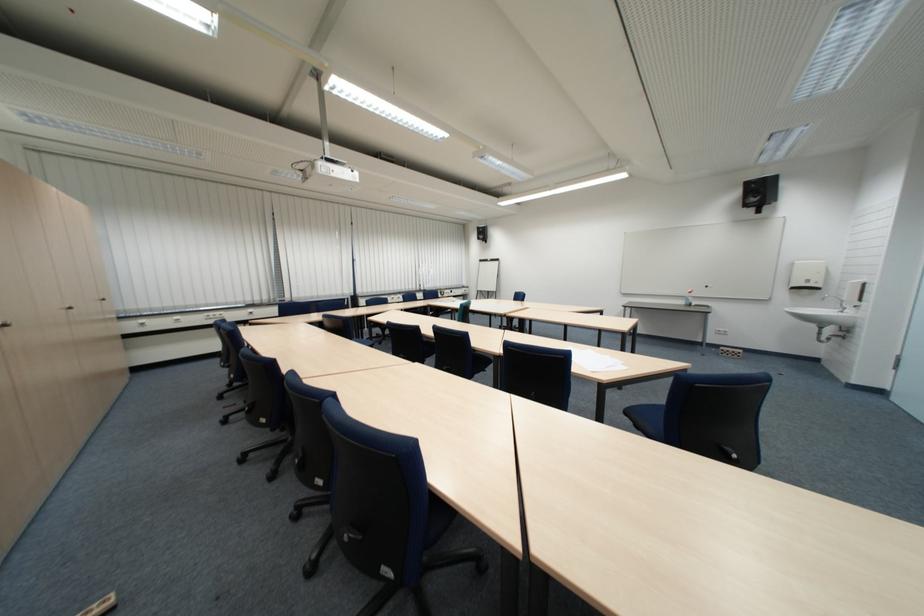
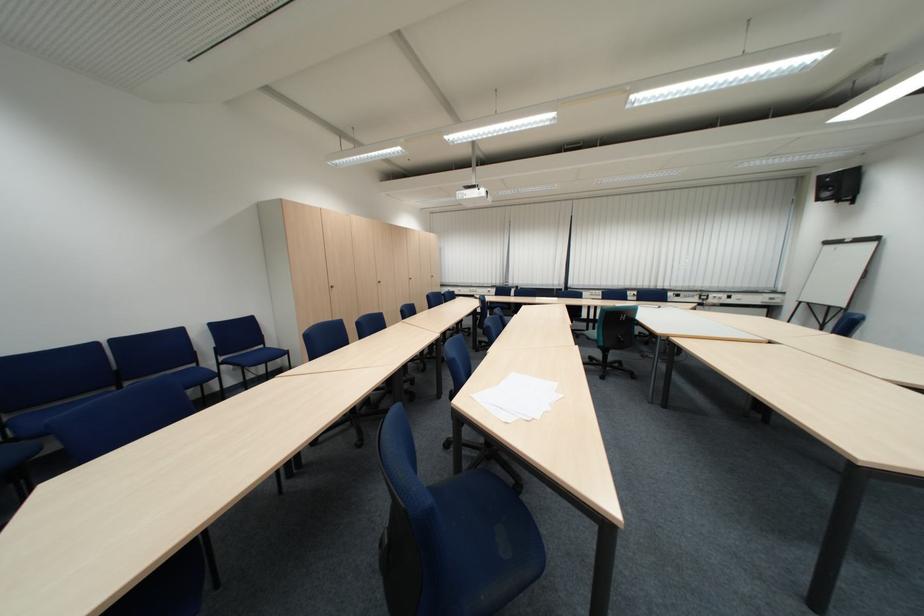
Where in the second image is the point corresponding to [353,294] from the first image?

(564, 284)